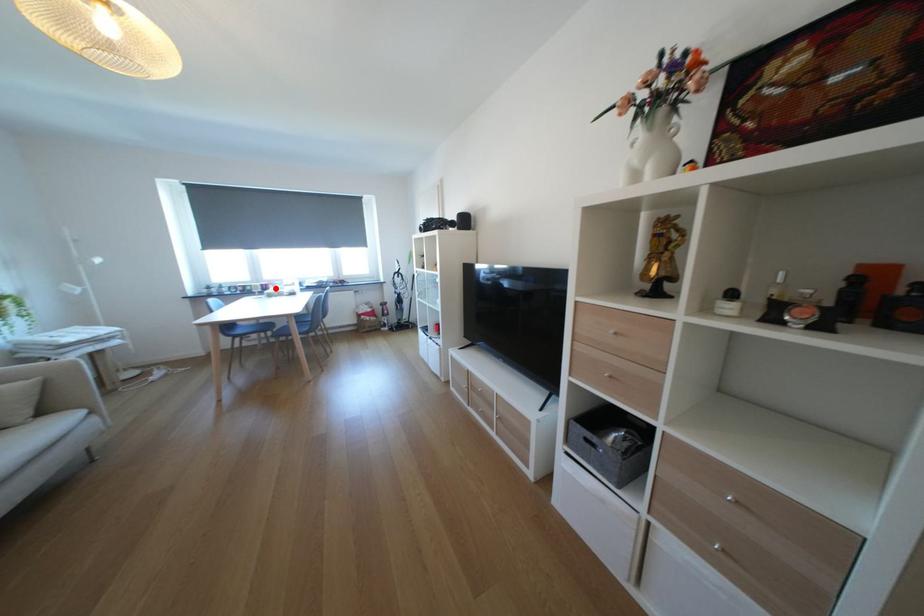
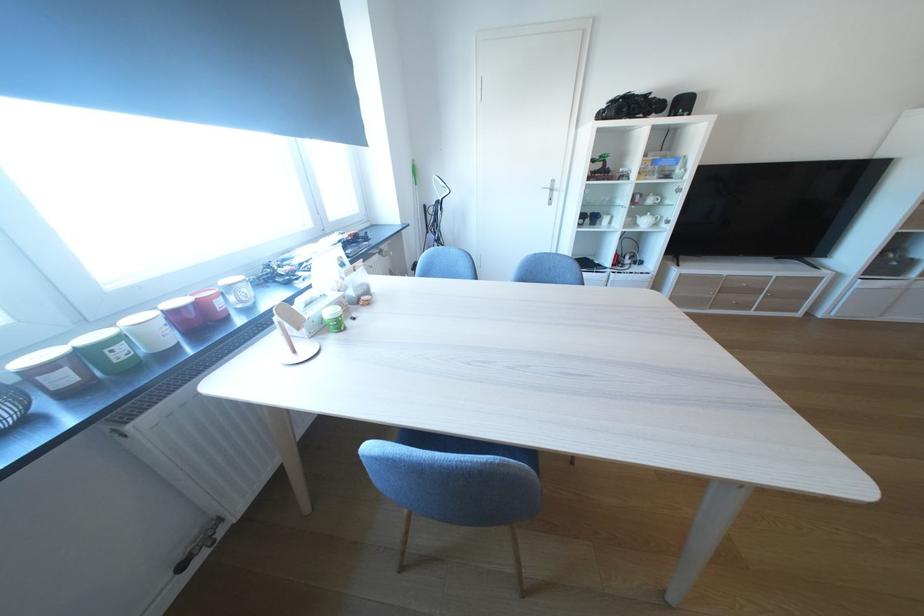
Where in the second image is the point corresponding to the highlighted location from the first image?

(207, 317)